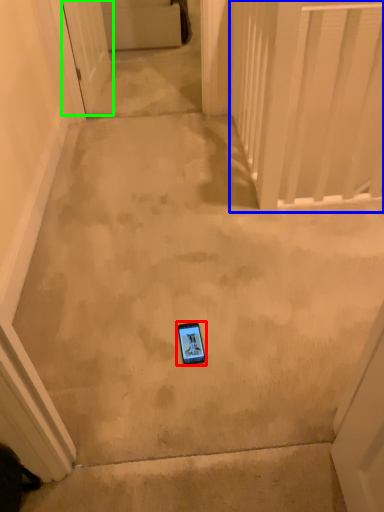
Question: Considering the real-world distances, which object is closest to mobile phone (highlighted by a red box)? balustrade (highlighted by a blue box) or door (highlighted by a green box).

Choices:
 (A) balustrade
 (B) door

Answer: (A)